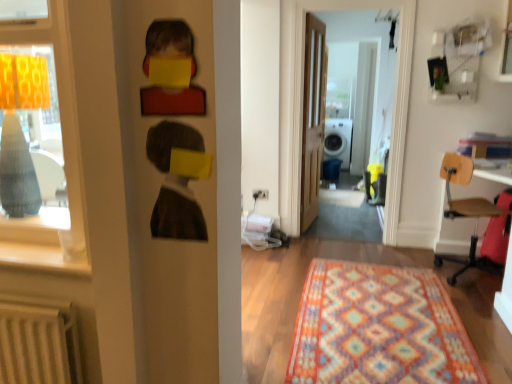
Question: Looking at their shapes, would you say wooden seat chair at right is wider or thinner than transparent glass door at center?

Choices:
 (A) thin
 (B) wide

Answer: (B)

Question: From the image's perspective, is wooden seat chair at right positioned above or below transparent glass door at center?

Choices:
 (A) below
 (B) above

Answer: (A)

Question: Which is farther from the charcoal textured portrait at center?

Choices:
 (A) transparent glass door at center
 (B) wooden door at center
 (C) blue fabric armchair at center
 (D) white plastic washer at center
 (E) multicolored woven rug at center

Answer: (D)

Question: Based on their relative distances, which object is nearer to the multicolored woven rug at center?

Choices:
 (A) matte wood window sill at left
 (B) matte white window frame at left
 (C) white plastic washer at center
 (D) blue fabric armchair at center
 (E) matte gray lampshade at left

Answer: (A)